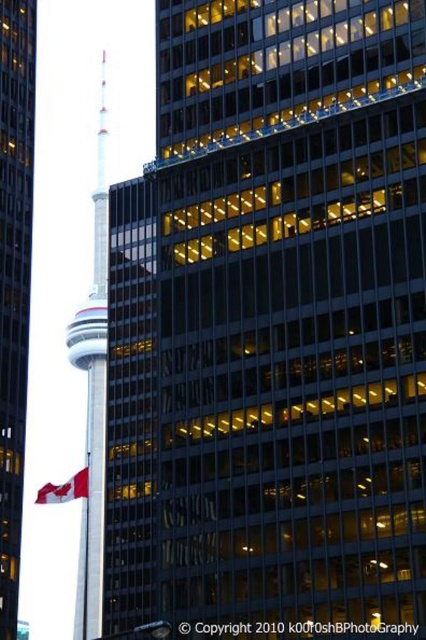
Question: Can you confirm if glassy steel tower at center is smaller than red fabric flag at left?

Choices:
 (A) no
 (B) yes

Answer: (B)

Question: Does glassy steel tower at center have a greater width compared to smooth glass tower at center?

Choices:
 (A) yes
 (B) no

Answer: (B)

Question: Can you confirm if glassy steel tower at center is smaller than smooth glass tower at center?

Choices:
 (A) yes
 (B) no

Answer: (A)

Question: Which of the following is the closest to the observer?

Choices:
 (A) (94, 408)
 (B) (20, 180)

Answer: (B)

Question: Which object is farther from the camera taking this photo?

Choices:
 (A) glassy steel tower at center
 (B) smooth glass tower at center

Answer: (B)

Question: Which point appears closest to the camera in this image?

Choices:
 (A) (23, 140)
 (B) (94, 228)
 (C) (80, 484)

Answer: (A)